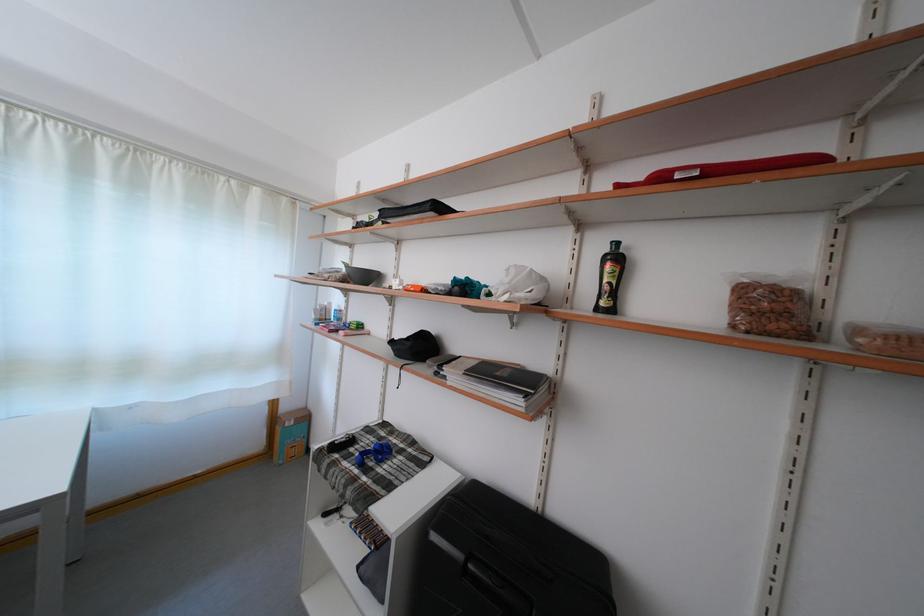
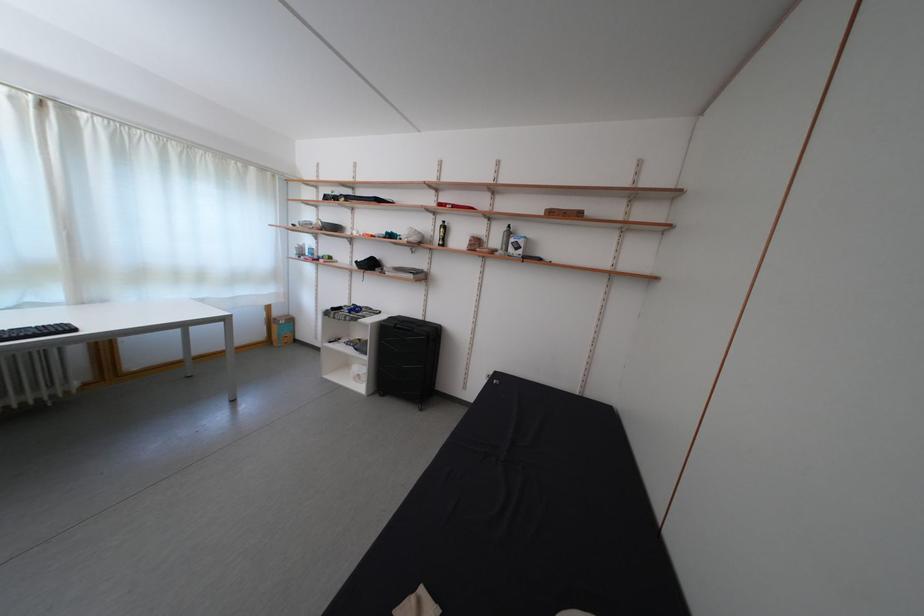
Locate, in the second image, the point that corresponds to the point at 293,415 in the first image.

(285, 320)